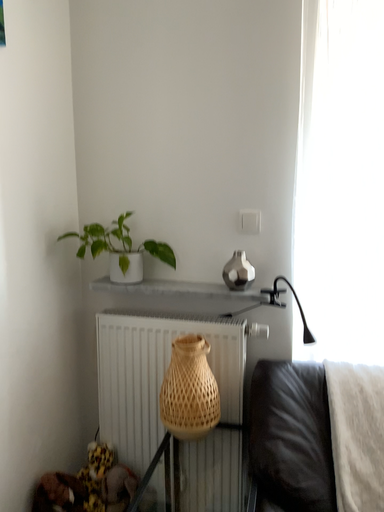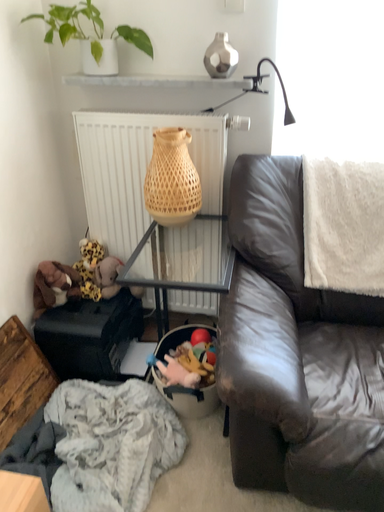
Question: How did the camera likely rotate when shooting the video?

Choices:
 (A) rotated downward
 (B) rotated upward

Answer: (A)